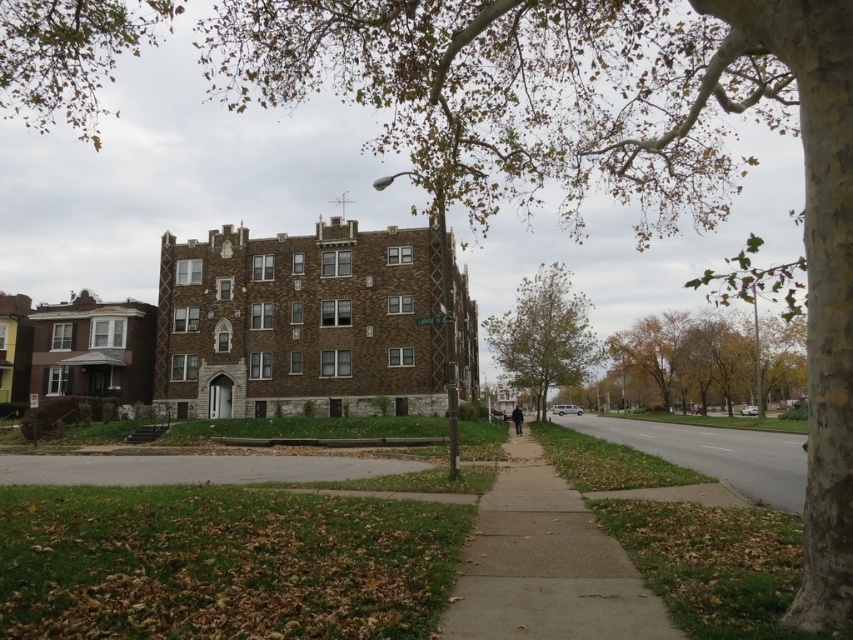
Question: Is yellow-green leaves at right to the left of green leafy tree at center from the viewer's perspective?

Choices:
 (A) no
 (B) yes

Answer: (A)

Question: Is yellow-green leaves at right positioned before gray asphalt pavement at lower center?

Choices:
 (A) yes
 (B) no

Answer: (B)

Question: Can you confirm if gray asphalt pavement at lower center is thinner than green leafy tree at center?

Choices:
 (A) yes
 (B) no

Answer: (B)

Question: Which of the following is the farthest from the observer?

Choices:
 (A) gray asphalt pavement at lower center
 (B) yellow-green leaves at right
 (C) green leafy tree at center
 (D) concrete sidewalk at center

Answer: (B)

Question: Which point is farther to the camera?

Choices:
 (A) (758, 332)
 (B) (556, 604)

Answer: (A)

Question: Which object is farther from the camera taking this photo?

Choices:
 (A) gray asphalt road at lower right
 (B) gray asphalt pavement at lower center
 (C) concrete sidewalk at center

Answer: (B)